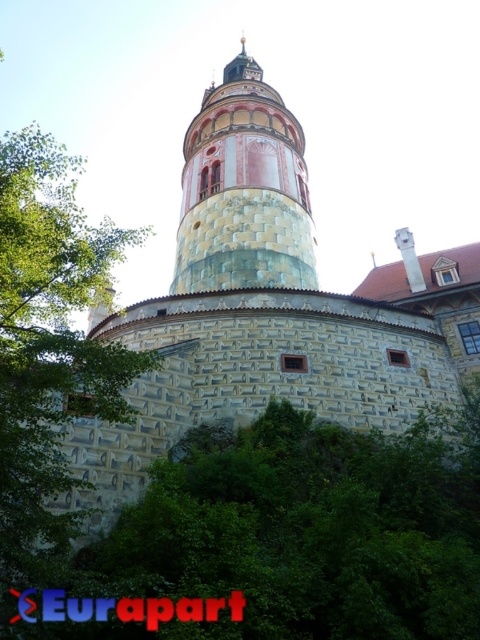
Question: Which of the following is the closest to the observer?

Choices:
 (A) (305, 467)
 (B) (265, 262)

Answer: (A)

Question: Is green leafy tree at lower center positioned in front of stone tower at center?

Choices:
 (A) no
 (B) yes

Answer: (B)

Question: Considering the relative positions of green leafy tree at lower center and stone tower at center in the image provided, where is green leafy tree at lower center located with respect to stone tower at center?

Choices:
 (A) left
 (B) right

Answer: (B)

Question: Which point is closer to the camera taking this photo?

Choices:
 (A) (251, 499)
 (B) (244, 253)

Answer: (A)

Question: Is green leafy tree at lower center thinner than stone tower at center?

Choices:
 (A) no
 (B) yes

Answer: (A)